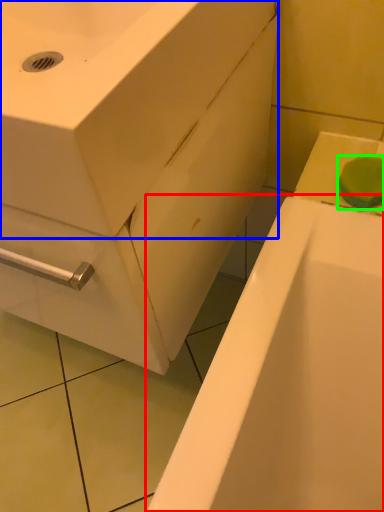
Question: Which object is the closest to the bathtub (highlighted by a red box)? Choose among these: sink (highlighted by a blue box) or soap (highlighted by a green box).

Choices:
 (A) sink
 (B) soap

Answer: (B)